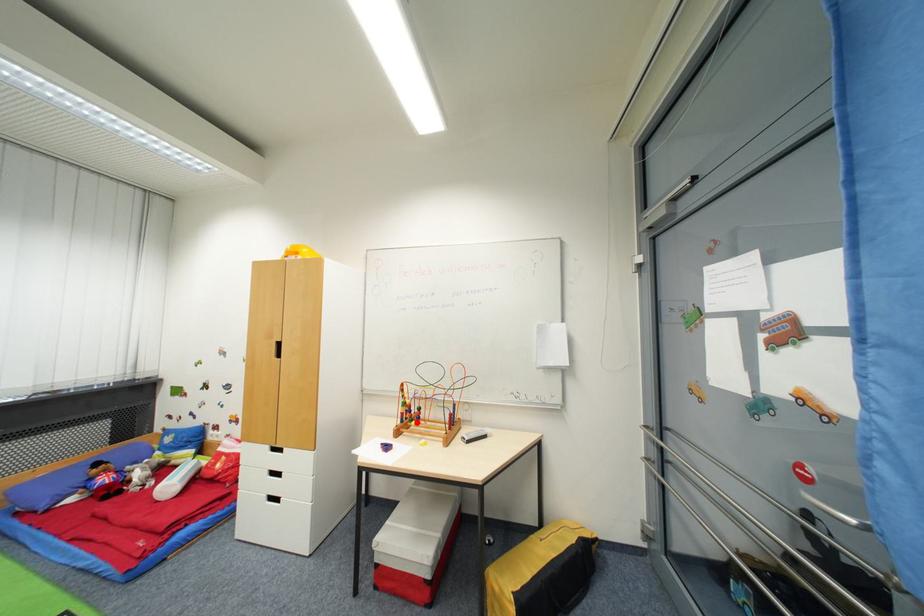
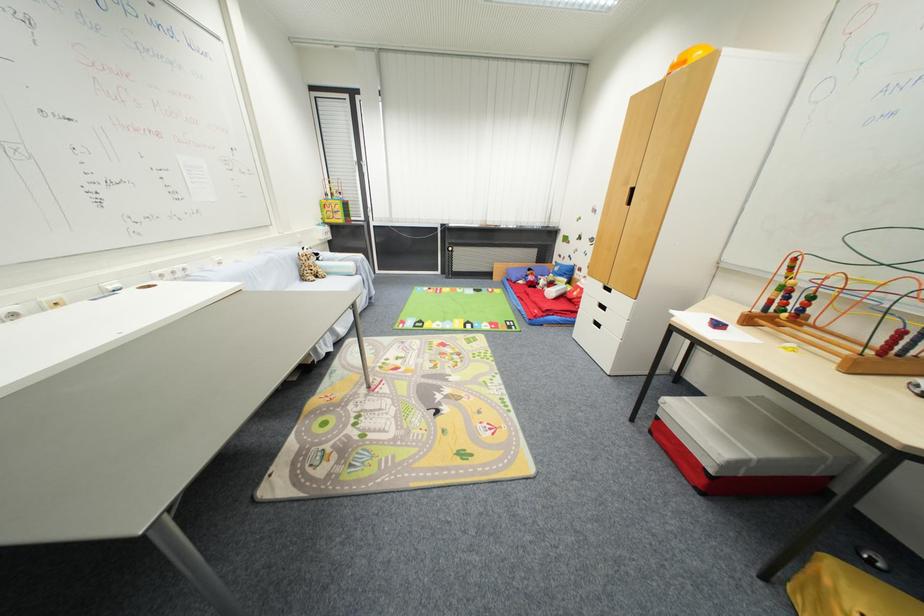
Locate, in the second image, the point that corresponds to the highlighted location in the first image.

(789, 313)